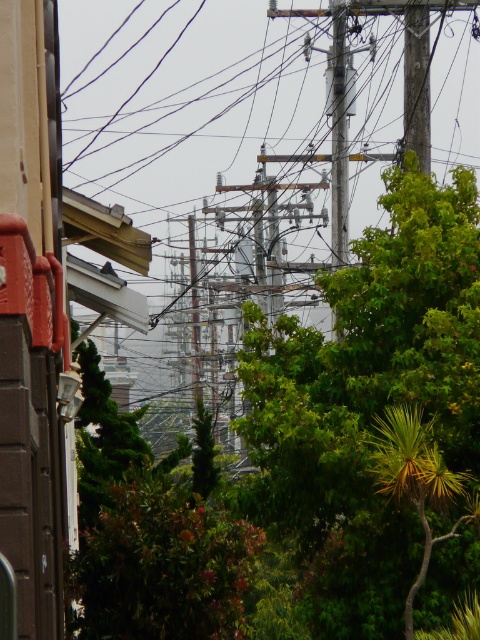
You are a photographer standing at the camera position in the scene. You want to take a photo that includes both the point at coordinates point (431,541) and point (420,13). Which point should you focus on to ensure both are in sharp focus?

You should focus on the point that is farther from the camera, which is point (420,13). This is because the depth of field will include both points when focusing on the farther one.

You are a city planner analyzing the urban scene. You notice the green leafy tree at center and the wooden at upper center. Based on their positions, which object is closer to the ground?

The green leafy tree at center is closer to the ground because it is positioned below the wooden at upper center.